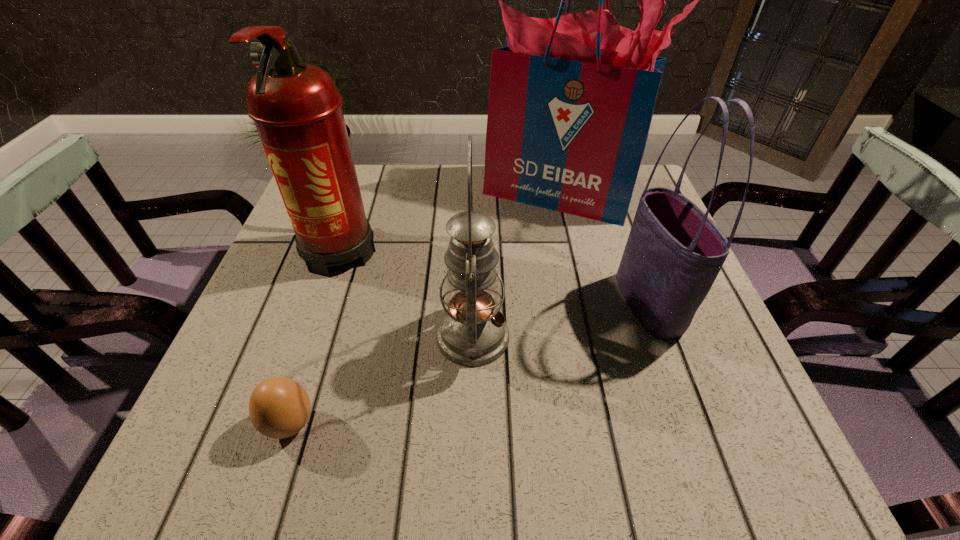
This screenshot has width=960, height=540. I want to click on vacant space located on the right of the shortest object, so click(372, 424).

Identify the location of grocery bag that is positioned at the far edge. (571, 99).

Locate an element on the screen. The width and height of the screenshot is (960, 540). fire extinguisher present at the far edge is located at coordinates (296, 107).

You are a GUI agent. You are given a task and a screenshot of the screen. Output one action in this format:
    pyautogui.click(x=<x>, y=<y>)
    Task: Click on the object that is at the near edge
    This screenshot has height=540, width=960.
    Given the screenshot: What is the action you would take?
    pyautogui.click(x=279, y=407)

The width and height of the screenshot is (960, 540). Identify the location of fire extinguisher that is at the left edge. (296, 107).

Locate an element on the screen. Image resolution: width=960 pixels, height=540 pixels. boiled egg present at the left edge is located at coordinates (279, 407).

Find the location of `grocery bag located in the right edge section of the desktop`. grocery bag located in the right edge section of the desktop is located at coordinates (571, 99).

At what (x,y) coordinates should I click in order to perform the action: click on tote bag that is at the right edge. Please return your answer as a coordinate pair (x, y). Looking at the image, I should click on 674,252.

This screenshot has width=960, height=540. Identify the location of object that is at the far left corner. (296, 107).

This screenshot has width=960, height=540. I want to click on object present at the near left corner, so click(279, 407).